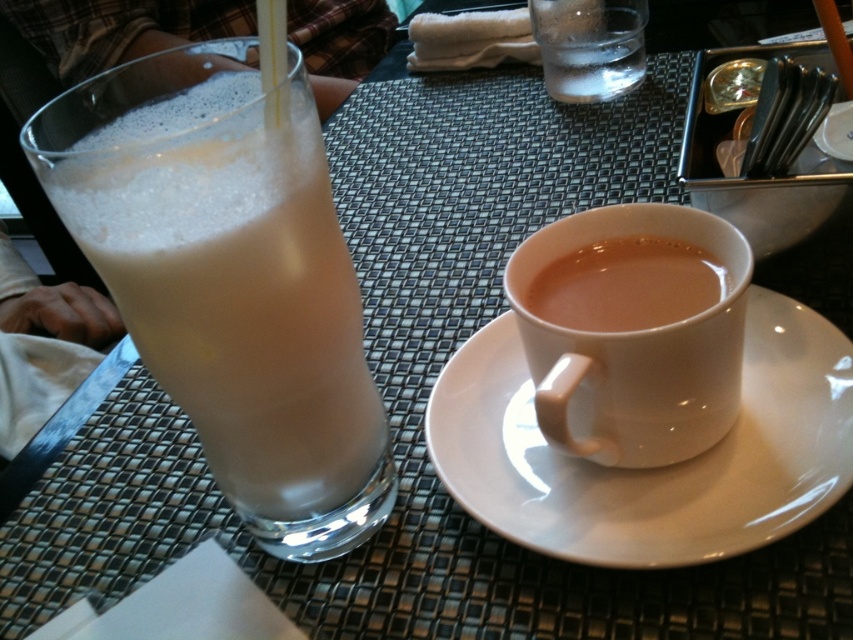
You are a barista trying to stack the milky white glass at left and the white ceramic saucer at center for cleaning. Which item should you place on top to ensure stability?

The white ceramic saucer at center should be placed on top because it is wider and thicker than the milky white glass at left, providing better stability during stacking.

You are a barista holding a tray and need to place the white ceramic mug at center onto the table. The tray is 10 inches wide. Can you safely place the mug on the tray without it hanging over the edge?

The white ceramic mug at center and camera are 9.31 inches apart from each other. Since the tray is 10 inches wide, the mug can be placed safely on the tray as its width is less than the tray size.

You are a customer at the table and want to reach for the white ceramic mug at center. Based on its coordinates, where exactly should you reach to pick it up?

The white ceramic mug at center is located at coordinates point (635, 348), so you should reach towards that exact point to pick it up.